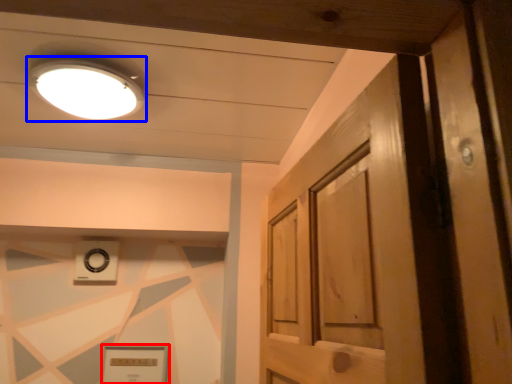
Question: Which of the following is the closest to the observer, picture frame (highlighted by a red box) or lighting (highlighted by a blue box)?

Choices:
 (A) picture frame
 (B) lighting

Answer: (B)